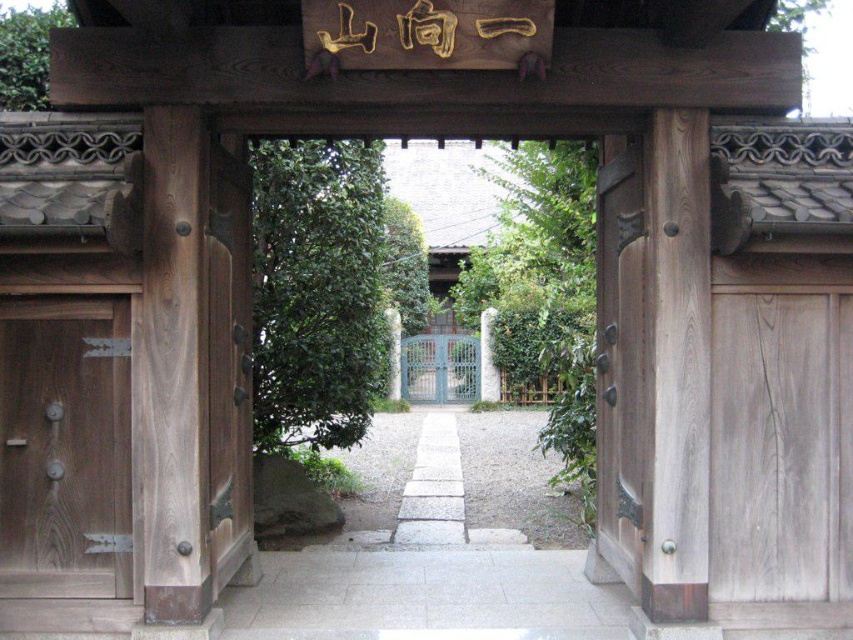
Between wooden door at left and gray stone path at center, which one is positioned higher?

wooden door at left is higher up.

The image size is (853, 640). What are the coordinates of `wooden door at left` in the screenshot? It's located at [x=67, y=456].

Is point (3, 554) positioned after point (305, 627)?

No, it is in front of (305, 627).

At what (x,y) coordinates should I click in order to perform the action: click on wooden door at left. Please return your answer as a coordinate pair (x, y). Looking at the image, I should click on (67, 456).

Is gray stone path at center shorter than smooth wooden door at right?

Yes.

Between point (270, 624) and point (633, 397), which one is positioned in front?

Point (633, 397)

At what (x,y) coordinates should I click in order to perform the action: click on gray stone path at center. Please return your answer as a coordinate pair (x, y). This screenshot has height=640, width=853. Looking at the image, I should click on (425, 596).

Is the position of gray stone path at center more distant than that of white stone path at center?

No, gray stone path at center is in front of white stone path at center.

The width and height of the screenshot is (853, 640). In order to click on gray stone path at center in this screenshot , I will do `click(425, 596)`.

This screenshot has height=640, width=853. Describe the element at coordinates (425, 596) in the screenshot. I see `gray stone path at center` at that location.

Identify the location of gray stone path at center. (425, 596).